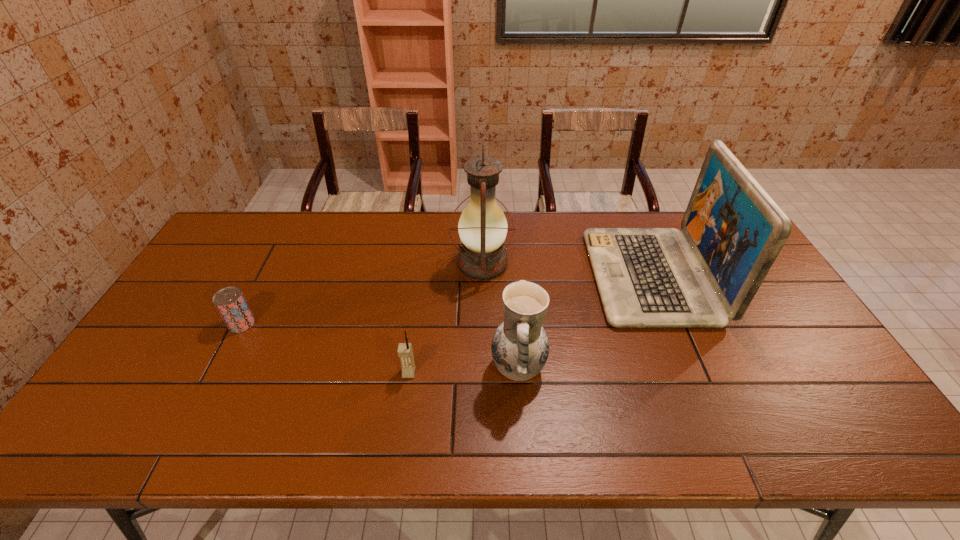
In order to click on free space between the third tallest object and the second tallest object in this screenshot , I will do `click(585, 322)`.

This screenshot has height=540, width=960. I want to click on vacant area that lies between the oil lamp and the pottery, so click(x=500, y=315).

At what (x,y) coordinates should I click in order to perform the action: click on object identified as the second closest to the laptop computer. Please return your answer as a coordinate pair (x, y). The height and width of the screenshot is (540, 960). Looking at the image, I should click on (482, 227).

Identify which object is located as the nearest to the pottery. Please provide its 2D coordinates. Your answer should be formatted as a tuple, i.e. [(x, y)], where the tuple contains the x and y coordinates of a point satisfying the conditions above.

[(647, 277)]

Identify the location of vacant region that satisfies the following two spatial constraints: 1. on the screen of the laptop computer; 2. on the front of the second object from left to right, where the keypad is located. (690, 373).